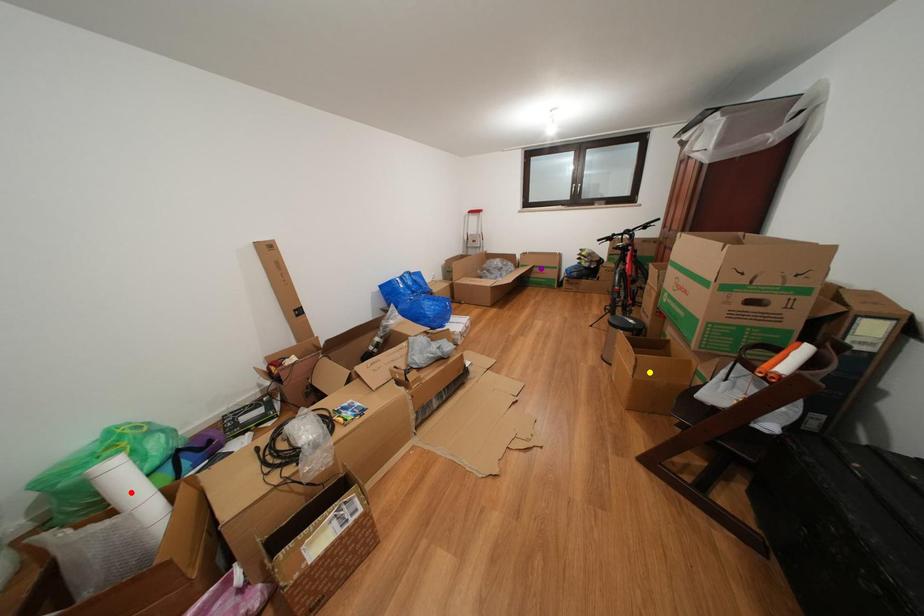
Order these from farthest to nearest:
- red point
- purple point
- yellow point

purple point, yellow point, red point